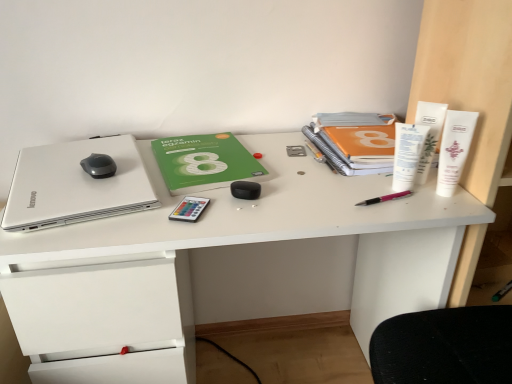
Locate an element on the screen. vacant area that is in front of black plastic remote control at center-left, positioned as the fifth stationery in right-to-left order is located at coordinates click(177, 233).